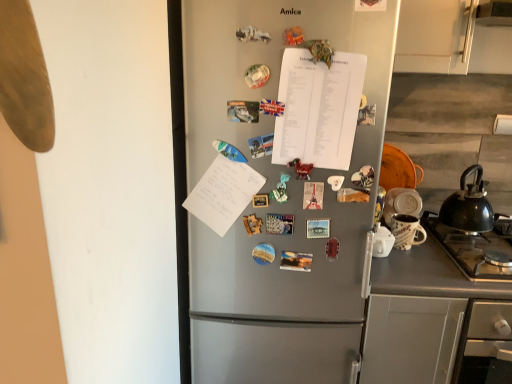
Question: Is gray matte counter at lower right not inside white paper at center?

Choices:
 (A) no
 (B) yes

Answer: (B)

Question: Is gray matte counter at lower right at the right side of white paper at center?

Choices:
 (A) no
 (B) yes

Answer: (B)

Question: From the image's perspective, would you say gray matte counter at lower right is shown under white paper at center?

Choices:
 (A) no
 (B) yes

Answer: (B)

Question: Considering the relative positions of gray matte counter at lower right and white paper at center in the image provided, is gray matte counter at lower right behind white paper at center?

Choices:
 (A) no
 (B) yes

Answer: (B)

Question: From a real-world perspective, does gray matte counter at lower right stand above white paper at center?

Choices:
 (A) yes
 (B) no

Answer: (B)

Question: Can you confirm if gray matte counter at lower right is smaller than white paper at center?

Choices:
 (A) no
 (B) yes

Answer: (A)

Question: Is gray matte counter at lower right aimed at satin silver fridge at center?

Choices:
 (A) yes
 (B) no

Answer: (B)

Question: From a real-world perspective, does gray matte counter at lower right sit lower than satin silver fridge at center?

Choices:
 (A) no
 (B) yes

Answer: (B)

Question: Is gray matte counter at lower right with satin silver fridge at center?

Choices:
 (A) no
 (B) yes

Answer: (A)

Question: Can satin silver fridge at center be found inside gray matte counter at lower right?

Choices:
 (A) no
 (B) yes

Answer: (A)

Question: Considering the relative positions of gray matte counter at lower right and satin silver fridge at center in the image provided, is gray matte counter at lower right in front of satin silver fridge at center?

Choices:
 (A) no
 (B) yes

Answer: (A)

Question: Does gray matte counter at lower right have a smaller size compared to satin silver fridge at center?

Choices:
 (A) no
 (B) yes

Answer: (B)

Question: Does satin silver fridge at center have a lesser width compared to gray matte counter at lower right?

Choices:
 (A) no
 (B) yes

Answer: (B)